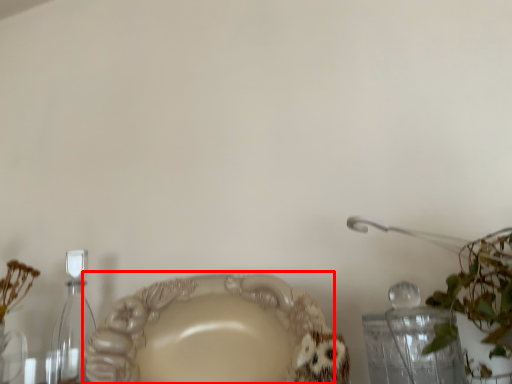
Question: Considering the relative positions of plate (annotated by the red box) and bottle in the image provided, where is plate (annotated by the red box) located with respect to the staircase?

Choices:
 (A) left
 (B) right

Answer: (B)